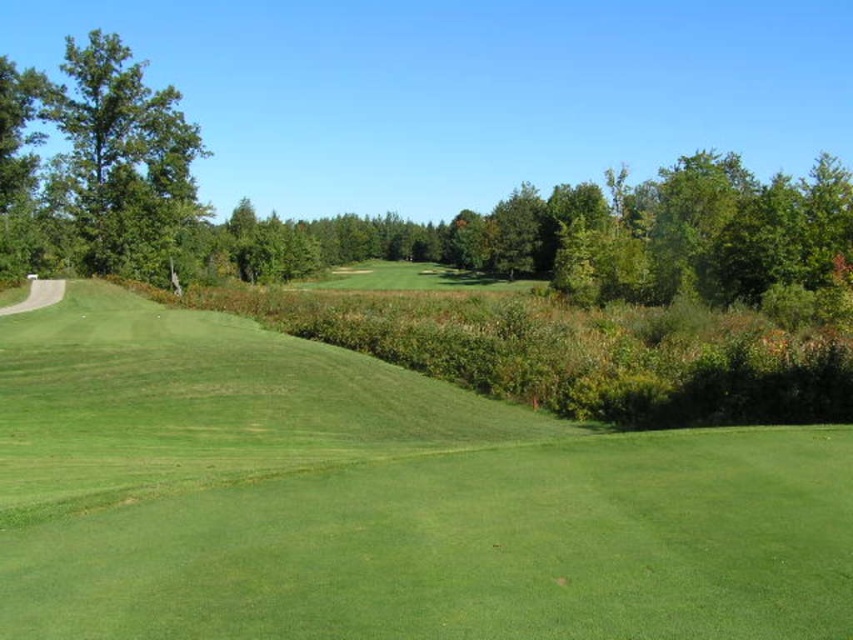
Identify the location of green grass at center. The image size is (853, 640). (379, 499).

Is green grass at center to the right of green leafy tree at left from the viewer's perspective?

Yes, green grass at center is to the right of green leafy tree at left.

You are a GUI agent. You are given a task and a screenshot of the screen. Output one action in this format:
    pyautogui.click(x=<x>, y=<y>)
    Task: Click on the green grass at center
    
    Given the screenshot: What is the action you would take?
    pyautogui.click(x=379, y=499)